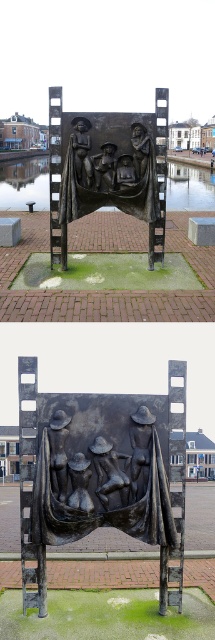
From the picture: Is bronze textured figures at center positioned at the back of bronze face at center?

No, it is not.

Is bronze textured figures at center above bronze face at center?

No.

Is point (133, 413) positioned after point (115, 164)?

No, it is not.

I want to click on bronze textured figures at center, so click(x=101, y=467).

The width and height of the screenshot is (215, 640). Identify the location of bronze textured figures at center. (101, 467).

Is bronze textured figures at center above bronze figure at center?

No, bronze textured figures at center is not above bronze figure at center.

Is bronze textured figures at center positioned behind bronze figure at center?

No.

You are a GUI agent. You are given a task and a screenshot of the screen. Output one action in this format:
    pyautogui.click(x=<x>, y=<y>)
    Task: Click on the bronze textured figures at center
    Image resolution: width=215 pixels, height=640 pixels.
    Given the screenshot: What is the action you would take?
    (101, 467)